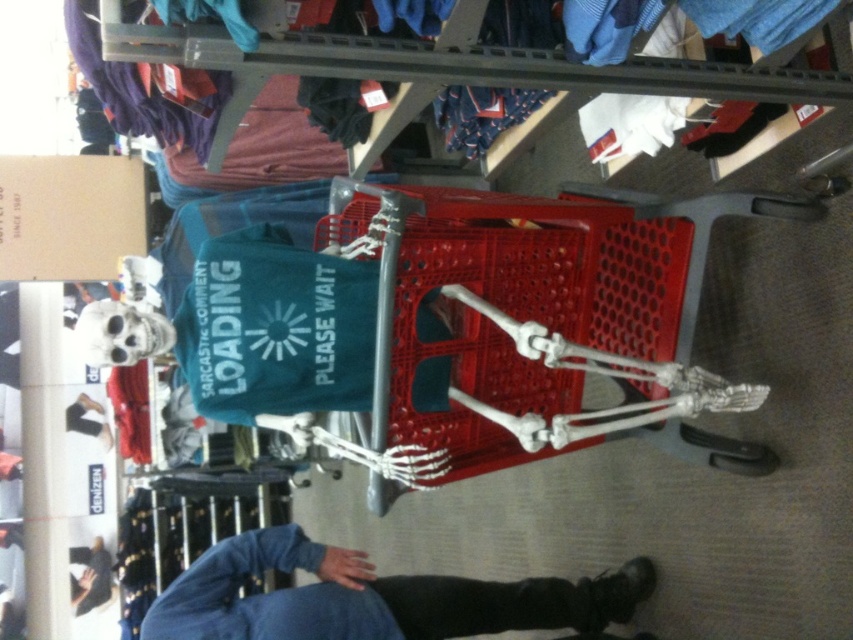
You are standing in a retail store and see a shopping cart with a green bag. There is a skeleton on top of the cart. You want to reach a point that is 6.43 feet away from you. Can you determine if the point at coordinates point (386,604) is within your reach?

The point at coordinates point (386,604) is 6.43 feet away from you, so it is within your reach if you can reach up to that distance.

From the picture: You are trying to decide whether to place a large box on the red plastic trolley at center or the blue soft sweatshirt at lower center. Based on their widths, which object can accommodate the box more comfortably?

The blue soft sweatshirt at lower center has a greater width than the red plastic trolley at center, so it can accommodate the large box more comfortably.

You are standing in front of the shopping cart and want to place a sticker on the point that is closer to you. Which point should you choose between point [468,358] and point [80,561]?

Point [468,358] is closer to the camera than point [80,561], so you should choose point [468,358] to place the sticker.